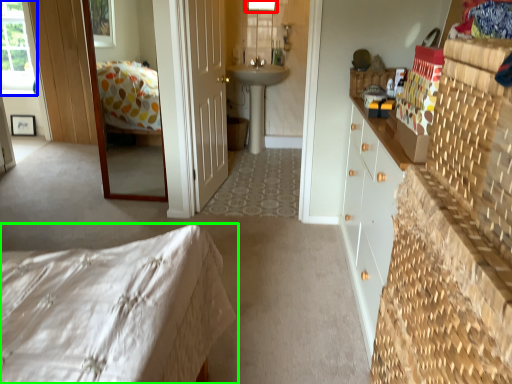
Question: Which object is positioned closest to window (highlighted by a red box)? Select from window (highlighted by a blue box) and bed (highlighted by a green box).

Choices:
 (A) window
 (B) bed

Answer: (A)